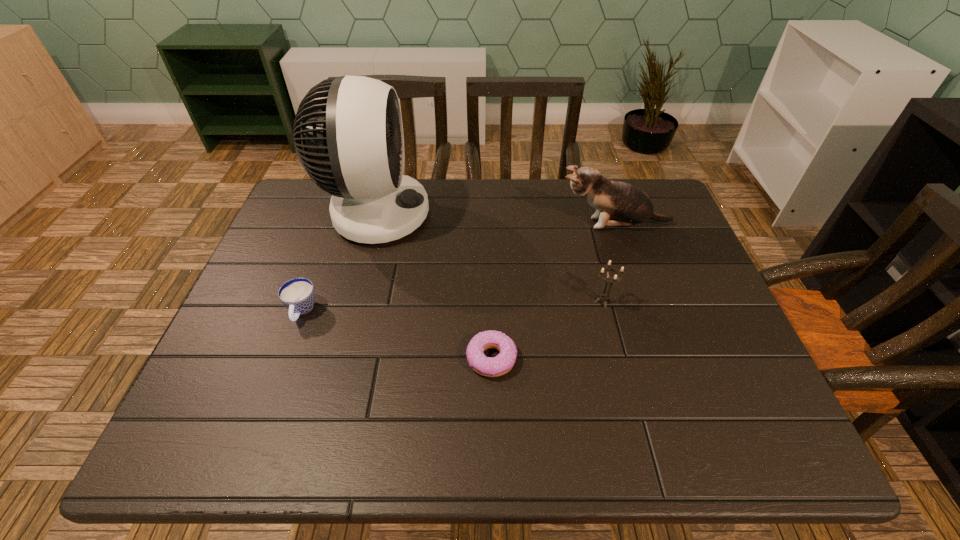
At what (x,y) coordinates should I click in order to perform the action: click on free space between the second shortest object and the third tallest object. Please return your answer as a coordinate pair (x, y). This screenshot has height=540, width=960. Looking at the image, I should click on (452, 306).

Find the location of a particular element. free space between the candle holder and the cup is located at coordinates (452, 306).

Image resolution: width=960 pixels, height=540 pixels. Identify the location of object that can be found as the second closest to the cat. (348, 131).

Image resolution: width=960 pixels, height=540 pixels. I want to click on object that ranks as the second closest to the fourth tallest object, so click(501, 364).

You are a GUI agent. You are given a task and a screenshot of the screen. Output one action in this format:
    pyautogui.click(x=<x>, y=<y>)
    Task: Click on the free space that satisfies the following two spatial constraints: 1. on the grille of the fan; 2. on the right side of the shortest object
    
    Given the screenshot: What is the action you would take?
    pyautogui.click(x=338, y=359)

In order to click on free space that satisfies the following two spatial constraints: 1. at the face of the cat; 2. on the side of the second shortest object with the handle in this screenshot , I will do `click(643, 311)`.

The image size is (960, 540). I want to click on free location that satisfies the following two spatial constraints: 1. at the face of the fourth shortest object; 2. on the side of the cup with the handle, so click(643, 311).

You are a GUI agent. You are given a task and a screenshot of the screen. Output one action in this format:
    pyautogui.click(x=<x>, y=<y>)
    Task: Click on the vacant space that satisfies the following two spatial constraints: 1. on the grille of the tallest object; 2. on the side of the second shortest object with the handle
    This screenshot has width=960, height=540.
    Given the screenshot: What is the action you would take?
    pyautogui.click(x=350, y=311)

Where is `free region that satisfies the following two spatial constraints: 1. at the face of the second tallest object; 2. on the side of the second shortest object with the handle`? This screenshot has height=540, width=960. free region that satisfies the following two spatial constraints: 1. at the face of the second tallest object; 2. on the side of the second shortest object with the handle is located at coordinates (643, 311).

You are a GUI agent. You are given a task and a screenshot of the screen. Output one action in this format:
    pyautogui.click(x=<x>, y=<y>)
    Task: Click on the free location that satisfies the following two spatial constraints: 1. at the face of the cat; 2. on the front side of the third shortest object
    The height and width of the screenshot is (540, 960).
    Given the screenshot: What is the action you would take?
    pyautogui.click(x=640, y=301)